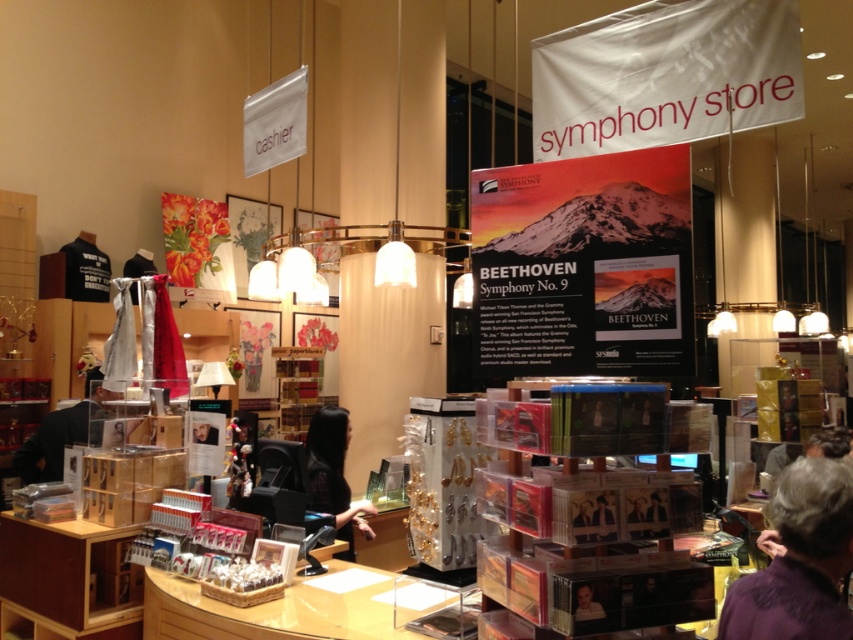
You are a customer entering the store and want to ask the cashier a question. Which object should you look at first to locate the cashier? The black hair at cashier or the smooth skin portrait at lower right?

You should look at the smooth skin portrait at lower right first because the black hair at cashier is below it, meaning the portrait is positioned higher up and likely more visible from the entrance.

You are a customer in the store and want to ask the cashier a question. Which object, the purple fabric at lower right or the black hair at cashier, is closer to you?

The purple fabric at lower right is closer to you because it is in front of the black hair at cashier.

You are a customer in the store and want to reach both the cashier counter and the shelves to the left of it. Which of the two points, point (732, 636) or point (587, 598), would you encounter first as you walk towards the cashier counter?

You would encounter point (732, 636) first because it is closer to you than point (587, 598), which is further away.